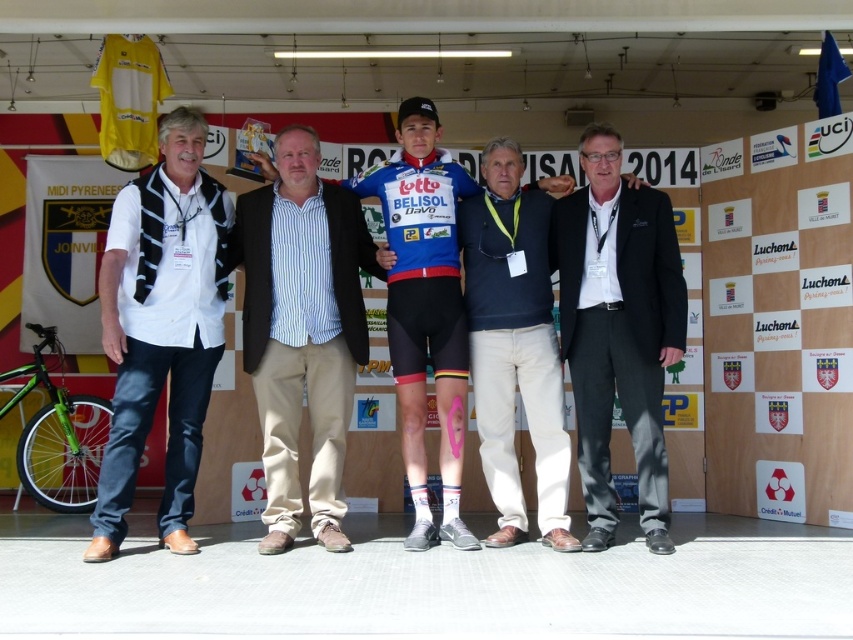
Is point (582, 252) closer to camera compared to point (450, 413)?

No, (582, 252) is behind (450, 413).

Who is positioned more to the right, black suit at center or blue jersey at center?

Positioned to the right is black suit at center.

I want to click on black suit at center, so click(x=618, y=330).

Is black suit at center closer to camera compared to dark blue cotton shirt at center?

Yes, black suit at center is closer to the viewer.

Between black suit at center and dark blue cotton shirt at center, which one appears on the right side from the viewer's perspective?

black suit at center is more to the right.

Is point (631, 198) positioned before point (463, 282)?

Yes, it is.

Find the location of a particular element. This screenshot has width=853, height=640. black suit at center is located at coordinates (618, 330).

Does white cotton shirt at left have a smaller size compared to striped cotton shirt at center?

Yes, white cotton shirt at left is smaller than striped cotton shirt at center.

Does white cotton shirt at left appear over striped cotton shirt at center?

Correct, white cotton shirt at left is located above striped cotton shirt at center.

Locate an element on the screen. Image resolution: width=853 pixels, height=640 pixels. white cotton shirt at left is located at coordinates (161, 326).